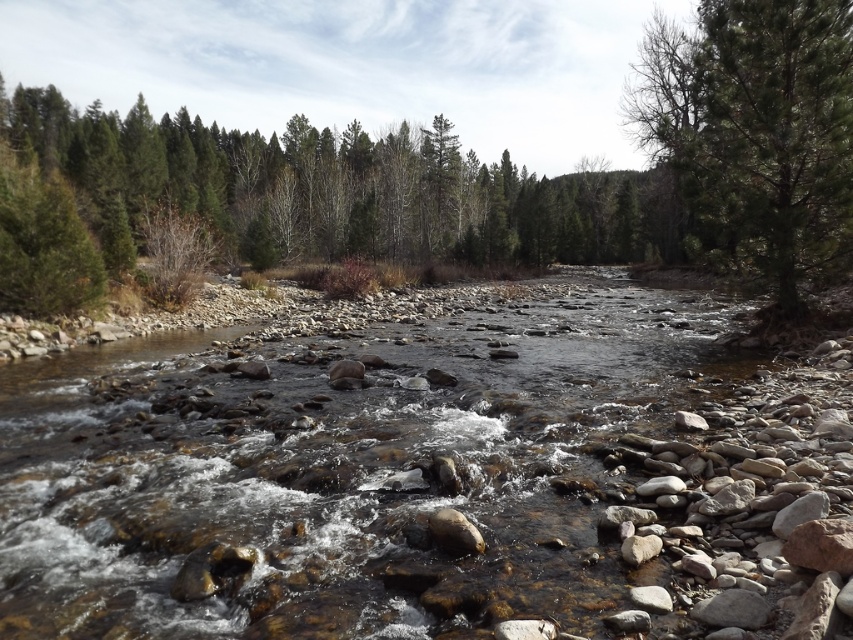
Who is positioned more to the right, smooth rock stream at center or green textured tree at upper right?

Positioned to the right is green textured tree at upper right.

Is point (572, 416) closer to camera compared to point (788, 148)?

Yes, it is.

Is point (77, 493) positioned after point (730, 12)?

No, (77, 493) is closer to viewer.

Find the location of a particular element. This screenshot has height=640, width=853. smooth rock stream at center is located at coordinates (343, 468).